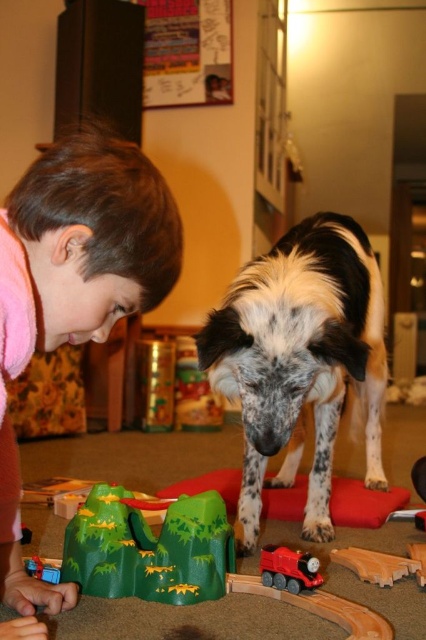
Question: In this image, where is spotted fur dog at center located relative to red plastic train at lower center?

Choices:
 (A) left
 (B) right

Answer: (B)

Question: Which point is closer to the camera?

Choices:
 (A) (91, 577)
 (B) (40, 326)

Answer: (B)

Question: Can you confirm if pink fleece at lower left is positioned to the right of green matte mountain at center?

Choices:
 (A) no
 (B) yes

Answer: (A)

Question: Is pink fleece at lower left above green matte mountain at center?

Choices:
 (A) yes
 (B) no

Answer: (A)

Question: Which object is farther from the camera taking this photo?

Choices:
 (A) green matte mountain at center
 (B) spotted fur dog at center
 (C) pink fleece at lower left
 (D) red plastic train at lower center

Answer: (B)

Question: Which point is farther to the camera?

Choices:
 (A) spotted fur dog at center
 (B) red plastic train at lower center

Answer: (A)